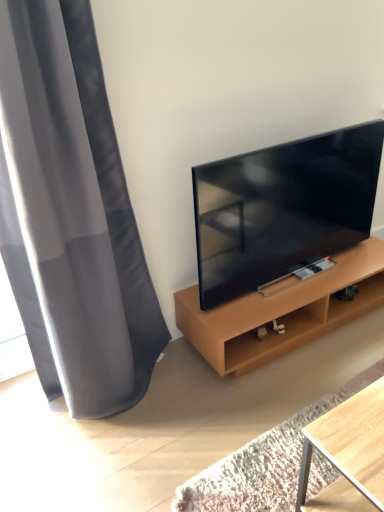
Question: Considering the relative sizes of gray fabric curtain at left and matte black tv at right in the image provided, is gray fabric curtain at left shorter than matte black tv at right?

Choices:
 (A) yes
 (B) no

Answer: (B)

Question: Is gray fabric curtain at left far from matte black tv at right?

Choices:
 (A) no
 (B) yes

Answer: (A)

Question: Considering the relative positions of gray fabric curtain at left and matte black tv at right in the image provided, is gray fabric curtain at left in front of matte black tv at right?

Choices:
 (A) no
 (B) yes

Answer: (B)

Question: Does gray fabric curtain at left have a greater width compared to matte black tv at right?

Choices:
 (A) yes
 (B) no

Answer: (A)

Question: Is gray fabric curtain at left at the left side of matte black tv at right?

Choices:
 (A) yes
 (B) no

Answer: (A)

Question: Considering the relative sizes of gray fabric curtain at left and matte black tv at right in the image provided, is gray fabric curtain at left smaller than matte black tv at right?

Choices:
 (A) yes
 (B) no

Answer: (B)

Question: Is wooden shelf at right shorter than matte black tv at right?

Choices:
 (A) no
 (B) yes

Answer: (B)

Question: Can we say wooden shelf at right lies outside matte black tv at right?

Choices:
 (A) no
 (B) yes

Answer: (B)

Question: Is the depth of wooden shelf at right less than that of matte black tv at right?

Choices:
 (A) no
 (B) yes

Answer: (A)

Question: Is wooden shelf at right not close to matte black tv at right?

Choices:
 (A) no
 (B) yes

Answer: (A)

Question: Can you confirm if wooden shelf at right is thinner than matte black tv at right?

Choices:
 (A) yes
 (B) no

Answer: (B)

Question: Does wooden shelf at right appear on the left side of matte black tv at right?

Choices:
 (A) yes
 (B) no

Answer: (B)

Question: Is matte black tv at right not close to wooden shelf at right?

Choices:
 (A) no
 (B) yes

Answer: (A)